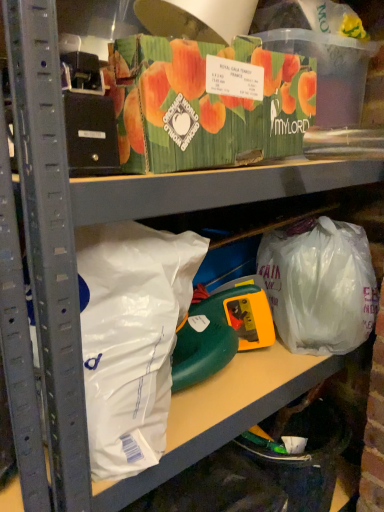
Where is `translucent plastic bag at lower right, the second plastic bag viewed from the front`? This screenshot has width=384, height=512. translucent plastic bag at lower right, the second plastic bag viewed from the front is located at coordinates (320, 285).

The image size is (384, 512). What do you see at coordinates (320, 285) in the screenshot? I see `translucent plastic bag at lower right, the first plastic bag when ordered from right to left` at bounding box center [320, 285].

This screenshot has width=384, height=512. Describe the element at coordinates (131, 337) in the screenshot. I see `white matte plastic bag at left, positioned as the second plastic bag in right-to-left order` at that location.

I want to click on white matte plastic bag at left, positioned as the second plastic bag in back-to-front order, so click(x=131, y=337).

Measure the distance between point (84, 240) and camera.

Point (84, 240) and camera are 22.40 inches apart from each other.

The width and height of the screenshot is (384, 512). Identify the location of translucent plastic bag at lower right, the first plastic bag when ordered from back to front. (320, 285).

Looking at this image, does white matte plastic bag at left, the 1th plastic bag positioned from the front, appear on the left side of translucent plastic bag at lower right, arranged as the second plastic bag when viewed from the left?

Yes.

Which object is closer to the camera taking this photo, white matte plastic bag at left, the 1th plastic bag positioned from the front, or translucent plastic bag at lower right, arranged as the second plastic bag when viewed from the left?

white matte plastic bag at left, the 1th plastic bag positioned from the front.

Is point (91, 279) behind point (350, 271)?

No, (91, 279) is in front of (350, 271).

From the picture: From the image's perspective, which is above, white matte plastic bag at left, the 1th plastic bag positioned from the front, or translucent plastic bag at lower right, the first plastic bag when ordered from back to front?

translucent plastic bag at lower right, the first plastic bag when ordered from back to front, appears higher in the image.

From a real-world perspective, does white matte plastic bag at left, positioned as the second plastic bag in right-to-left order, stand above translucent plastic bag at lower right, the second plastic bag viewed from the front?

Yes, from a real-world perspective, white matte plastic bag at left, positioned as the second plastic bag in right-to-left order, is on top of translucent plastic bag at lower right, the second plastic bag viewed from the front.

Is white matte plastic bag at left, positioned as the second plastic bag in right-to-left order, wider or thinner than translucent plastic bag at lower right, the second plastic bag viewed from the front?

Considering their sizes, white matte plastic bag at left, positioned as the second plastic bag in right-to-left order, looks slimmer than translucent plastic bag at lower right, the second plastic bag viewed from the front.

Which of these two, white matte plastic bag at left, which is counted as the first plastic bag, starting from the left, or translucent plastic bag at lower right, the first plastic bag when ordered from back to front, stands taller?

With more height is white matte plastic bag at left, which is counted as the first plastic bag, starting from the left.

Between white matte plastic bag at left, positioned as the second plastic bag in right-to-left order, and translucent plastic bag at lower right, the first plastic bag when ordered from right to left, which one has larger size?

Bigger between the two is translucent plastic bag at lower right, the first plastic bag when ordered from right to left.

Looking at this image, is white matte plastic bag at left, positioned as the second plastic bag in back-to-front order, spatially inside translucent plastic bag at lower right, the first plastic bag when ordered from back to front, or outside of it?

white matte plastic bag at left, positioned as the second plastic bag in back-to-front order, is located beyond the bounds of translucent plastic bag at lower right, the first plastic bag when ordered from back to front.

From the picture: Is white matte plastic bag at left, positioned as the second plastic bag in right-to-left order, with translucent plastic bag at lower right, arranged as the second plastic bag when viewed from the left?

white matte plastic bag at left, positioned as the second plastic bag in right-to-left order, is not next to translucent plastic bag at lower right, arranged as the second plastic bag when viewed from the left, and they're not touching.

Is white matte plastic bag at left, positioned as the second plastic bag in right-to-left order, turned away from translucent plastic bag at lower right, the second plastic bag viewed from the front?

No, translucent plastic bag at lower right, the second plastic bag viewed from the front, is not at the back of white matte plastic bag at left, positioned as the second plastic bag in right-to-left order.

Locate an element on the screen. plastic bag that is above the white matte plastic bag at left, positioned as the second plastic bag in back-to-front order (from the image's perspective) is located at coordinates (320, 285).

Based on their positions, is translucent plastic bag at lower right, the first plastic bag when ordered from back to front, located to the left or right of white matte plastic bag at left, the 1th plastic bag positioned from the front?

translucent plastic bag at lower right, the first plastic bag when ordered from back to front, is positioned on white matte plastic bag at left, the 1th plastic bag positioned from the front,'s right side.

Does translucent plastic bag at lower right, the first plastic bag when ordered from back to front, come in front of white matte plastic bag at left, the 1th plastic bag positioned from the front?

That is False.

Is point (319, 308) farther from viewer compared to point (137, 440)?

Yes, point (319, 308) is behind point (137, 440).

From the image's perspective, is translucent plastic bag at lower right, the first plastic bag when ordered from right to left, above or below white matte plastic bag at left, positioned as the second plastic bag in right-to-left order?

Clearly, from the image's perspective, translucent plastic bag at lower right, the first plastic bag when ordered from right to left, is above white matte plastic bag at left, positioned as the second plastic bag in right-to-left order.

From a real-world perspective, who is located lower, translucent plastic bag at lower right, the second plastic bag viewed from the front, or white matte plastic bag at left, which is counted as the first plastic bag, starting from the left?

translucent plastic bag at lower right, the second plastic bag viewed from the front.

Which of these two, translucent plastic bag at lower right, arranged as the second plastic bag when viewed from the left, or white matte plastic bag at left, positioned as the second plastic bag in right-to-left order, is thinner?

white matte plastic bag at left, positioned as the second plastic bag in right-to-left order.

Which of these two, translucent plastic bag at lower right, the second plastic bag viewed from the front, or white matte plastic bag at left, positioned as the second plastic bag in right-to-left order, stands shorter?

Standing shorter between the two is translucent plastic bag at lower right, the second plastic bag viewed from the front.

Considering the sizes of objects translucent plastic bag at lower right, the second plastic bag viewed from the front, and white matte plastic bag at left, which is counted as the first plastic bag, starting from the left, in the image provided, who is smaller, translucent plastic bag at lower right, the second plastic bag viewed from the front, or white matte plastic bag at left, which is counted as the first plastic bag, starting from the left,?

white matte plastic bag at left, which is counted as the first plastic bag, starting from the left.

Is translucent plastic bag at lower right, the first plastic bag when ordered from right to left, inside or outside of white matte plastic bag at left, the 1th plastic bag positioned from the front?

translucent plastic bag at lower right, the first plastic bag when ordered from right to left, exists outside the volume of white matte plastic bag at left, the 1th plastic bag positioned from the front.

Can you see translucent plastic bag at lower right, the first plastic bag when ordered from back to front, touching white matte plastic bag at left, the 1th plastic bag positioned from the front?

No, translucent plastic bag at lower right, the first plastic bag when ordered from back to front, is not in contact with white matte plastic bag at left, the 1th plastic bag positioned from the front.

Is translucent plastic bag at lower right, the first plastic bag when ordered from right to left, aimed at white matte plastic bag at left, positioned as the second plastic bag in back-to-front order?

No.

How far apart are translucent plastic bag at lower right, the first plastic bag when ordered from right to left, and white matte plastic bag at left, the 1th plastic bag positioned from the front?

translucent plastic bag at lower right, the first plastic bag when ordered from right to left, and white matte plastic bag at left, the 1th plastic bag positioned from the front, are 16.47 inches apart.

In the image, there is a white matte plastic bag at left, the 1th plastic bag positioned from the front. Where is `plastic bag below it (from a real-world perspective)`? This screenshot has width=384, height=512. plastic bag below it (from a real-world perspective) is located at coordinates (320, 285).

Identify the location of plastic bag on the right of white matte plastic bag at left, positioned as the second plastic bag in right-to-left order. (320, 285).

Locate an element on the screen. The image size is (384, 512). plastic bag above the white matte plastic bag at left, positioned as the second plastic bag in right-to-left order (from the image's perspective) is located at coordinates (320, 285).